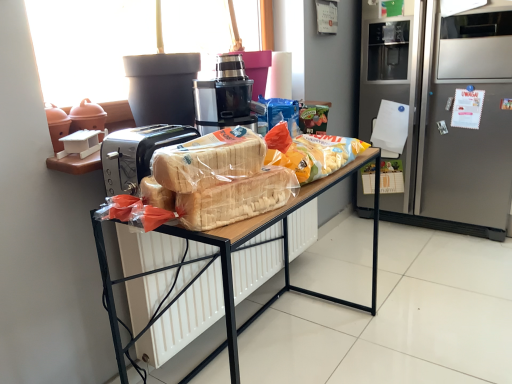
Describe the element at coordinates (222, 178) in the screenshot. Image resolution: width=512 pixels, height=384 pixels. I see `translucent plastic bread at center, positioned as the third snack in back-to-front order` at that location.

Image resolution: width=512 pixels, height=384 pixels. Describe the element at coordinates (224, 97) in the screenshot. I see `black plastic juicer at center` at that location.

Describe the element at coordinates (310, 152) in the screenshot. This screenshot has width=512, height=384. I see `translucent plastic bag of chips at center, which is counted as the 1th snack, starting from the back` at that location.

What do you see at coordinates (209, 160) in the screenshot? This screenshot has height=384, width=512. I see `translucent plastic bread at center, arranged as the second snack when viewed from the back` at bounding box center [209, 160].

Identify the location of wooden desk at center. The height and width of the screenshot is (384, 512). (283, 255).

Image resolution: width=512 pixels, height=384 pixels. Find the location of `desk in front of the satin silver refrigerator at right`. desk in front of the satin silver refrigerator at right is located at coordinates (283, 255).

Is point (106, 274) in front of point (486, 212)?

Yes, point (106, 274) is in front of point (486, 212).

How different are the orientations of wooden desk at center and satin silver refrigerator at right in degrees?

91.6 degrees.

Does wooden desk at center have a greater height compared to satin silver refrigerator at right?

No.

Consider the image. Considering the sizes of objects satin silver refrigerator at right and translucent plastic bread at center, which is the second snack from front to back, in the image provided, who is smaller, satin silver refrigerator at right or translucent plastic bread at center, which is the second snack from front to back,?

Smaller between the two is translucent plastic bread at center, which is the second snack from front to back.

From a real-world perspective, is satin silver refrigerator at right on top of translucent plastic bread at center, arranged as the second snack when viewed from the back?

No, from a real-world perspective, satin silver refrigerator at right is not over translucent plastic bread at center, arranged as the second snack when viewed from the back

Considering the sizes of satin silver refrigerator at right and translucent plastic bread at center, arranged as the second snack when viewed from the back, in the image, is satin silver refrigerator at right taller or shorter than translucent plastic bread at center, arranged as the second snack when viewed from the back,?

satin silver refrigerator at right is taller than translucent plastic bread at center, arranged as the second snack when viewed from the back.

From the image's perspective, is satin silver refrigerator at right on top of translucent plastic bread at center, arranged as the second snack when viewed from the back?

Correct, satin silver refrigerator at right appears higher than translucent plastic bread at center, arranged as the second snack when viewed from the back, in the image.

Are translucent plastic bread at center, which is the second snack from front to back, and translucent plastic bag of chips at center, which is counted as the 1th snack, starting from the back, located far from each other?

That's not correct — translucent plastic bread at center, which is the second snack from front to back, is a little close to translucent plastic bag of chips at center, which is counted as the 1th snack, starting from the back.

Does point (168, 168) come farther from viewer compared to point (332, 138)?

That is False.

From a real-world perspective, does translucent plastic bread at center, which is the second snack from front to back, stand above translucent plastic bag of chips at center, which is counted as the 1th snack, starting from the back?

Yes, from a real-world perspective, translucent plastic bread at center, which is the second snack from front to back, is above translucent plastic bag of chips at center, which is counted as the 1th snack, starting from the back.

Considering the relative sizes of translucent plastic bread at center, which is the second snack from front to back, and translucent plastic bag of chips at center, which is counted as the 1th snack, starting from the back, in the image provided, is translucent plastic bread at center, which is the second snack from front to back, smaller than translucent plastic bag of chips at center, which is counted as the 1th snack, starting from the back,?

Indeed, translucent plastic bread at center, which is the second snack from front to back, has a smaller size compared to translucent plastic bag of chips at center, which is counted as the 1th snack, starting from the back.

Is translucent plastic bread at center, the 1th snack viewed from the front, bigger than translucent plastic bag of chips at center, which is counted as the 1th snack, starting from the back?

No.

In the scene shown: Considering the relative sizes of translucent plastic bread at center, the 1th snack viewed from the front, and translucent plastic bag of chips at center, which is counted as the 1th snack, starting from the back, in the image provided, is translucent plastic bread at center, the 1th snack viewed from the front, shorter than translucent plastic bag of chips at center, which is counted as the 1th snack, starting from the back,?

Yes, translucent plastic bread at center, the 1th snack viewed from the front, is shorter than translucent plastic bag of chips at center, which is counted as the 1th snack, starting from the back.

Looking at their sizes, would you say translucent plastic bread at center, positioned as the third snack in back-to-front order, is wider or thinner than translucent plastic bag of chips at center, which appears as the 3th snack when viewed from the front?

translucent plastic bread at center, positioned as the third snack in back-to-front order, is thinner than translucent plastic bag of chips at center, which appears as the 3th snack when viewed from the front.

Is translucent plastic bread at center, positioned as the third snack in back-to-front order, to the left or to the right of translucent plastic bag of chips at center, which is counted as the 1th snack, starting from the back, in the image?

translucent plastic bread at center, positioned as the third snack in back-to-front order, is to the left of translucent plastic bag of chips at center, which is counted as the 1th snack, starting from the back.

From a real-world perspective, is satin silver refrigerator at right over translucent plastic bag of chips at center, which appears as the 3th snack when viewed from the front?

No, from a real-world perspective, satin silver refrigerator at right is not on top of translucent plastic bag of chips at center, which appears as the 3th snack when viewed from the front.

Which object is further away from the camera taking this photo, satin silver refrigerator at right or translucent plastic bag of chips at center, which is counted as the 1th snack, starting from the back?

satin silver refrigerator at right is more distant.

Between satin silver refrigerator at right and translucent plastic bag of chips at center, which is counted as the 1th snack, starting from the back, which one has less height?

translucent plastic bag of chips at center, which is counted as the 1th snack, starting from the back, is shorter.

What's the angular difference between satin silver refrigerator at right and translucent plastic bag of chips at center, which is counted as the 1th snack, starting from the back,'s facing directions?

satin silver refrigerator at right and translucent plastic bag of chips at center, which is counted as the 1th snack, starting from the back, are facing 90.4 degrees away from each other.

Would you say satin silver refrigerator at right contains wooden desk at center?

Actually, wooden desk at center is outside satin silver refrigerator at right.

Could you tell me if satin silver refrigerator at right is turned towards wooden desk at center?

Yes.

Between satin silver refrigerator at right and wooden desk at center, which one appears on the left side from the viewer's perspective?

Positioned to the left is wooden desk at center.

Considering the sizes of objects translucent plastic bread at center, positioned as the third snack in back-to-front order, and black plastic juicer at center in the image provided, who is smaller, translucent plastic bread at center, positioned as the third snack in back-to-front order, or black plastic juicer at center?

With smaller size is translucent plastic bread at center, positioned as the third snack in back-to-front order.

Is point (186, 205) closer or farther from the camera than point (194, 84)?

Clearly, point (186, 205) is closer to the camera than point (194, 84).

At what (x,y) coordinates should I click in order to perform the action: click on refrigerator located above the wooden desk at center (from a real-world perspective). Please return your answer as a coordinate pair (x, y). This screenshot has width=512, height=384. Looking at the image, I should click on (446, 112).

I want to click on refrigerator behind the translucent plastic bread at center, which is the second snack from front to back, so click(x=446, y=112).

Looking at the image, which one is located further to translucent plastic bread at center, the 1th snack viewed from the front, translucent plastic bread at center, which is the second snack from front to back, or satin silver refrigerator at right?

The object further to translucent plastic bread at center, the 1th snack viewed from the front, is satin silver refrigerator at right.

Looking at the image, which one is located further to translucent plastic bread at center, positioned as the third snack in back-to-front order, translucent plastic bag of chips at center, which is counted as the 1th snack, starting from the back, or black plastic juicer at center?

Among the two, translucent plastic bag of chips at center, which is counted as the 1th snack, starting from the back, is located further to translucent plastic bread at center, positioned as the third snack in back-to-front order.

Which object lies nearer to the anchor point wooden desk at center, translucent plastic bread at center, the 1th snack viewed from the front, or satin silver refrigerator at right?

Result: translucent plastic bread at center, the 1th snack viewed from the front, lies closer to wooden desk at center than the other object.

Based on their spatial positions, is wooden desk at center or translucent plastic bag of chips at center, which is counted as the 1th snack, starting from the back, closer to black plastic juicer at center?

translucent plastic bag of chips at center, which is counted as the 1th snack, starting from the back, is closer to black plastic juicer at center.

Which object lies nearer to the anchor point translucent plastic bag of chips at center, which appears as the 3th snack when viewed from the front, translucent plastic bread at center, the 1th snack viewed from the front, or translucent plastic bread at center, arranged as the second snack when viewed from the back?

Among the two, translucent plastic bread at center, the 1th snack viewed from the front, is located nearer to translucent plastic bag of chips at center, which appears as the 3th snack when viewed from the front.

Looking at the image, which one is located closer to translucent plastic bread at center, the 1th snack viewed from the front, wooden desk at center or translucent plastic bag of chips at center, which appears as the 3th snack when viewed from the front?

Among the two, translucent plastic bag of chips at center, which appears as the 3th snack when viewed from the front, is located nearer to translucent plastic bread at center, the 1th snack viewed from the front.

Considering their positions, is translucent plastic bag of chips at center, which appears as the 3th snack when viewed from the front, positioned closer to translucent plastic bread at center, which is the second snack from front to back, than wooden desk at center?

Among the two, translucent plastic bag of chips at center, which appears as the 3th snack when viewed from the front, is located nearer to translucent plastic bread at center, which is the second snack from front to back.

Based on the photo, considering their positions, is translucent plastic bread at center, positioned as the third snack in back-to-front order, positioned further to wooden desk at center than translucent plastic bread at center, arranged as the second snack when viewed from the back?

translucent plastic bread at center, arranged as the second snack when viewed from the back, lies further to wooden desk at center than the other object.

Find the location of a particular element. This screenshot has width=512, height=384. snack between translucent plastic bread at center, arranged as the second snack when viewed from the back, and wooden desk at center, in the vertical direction is located at coordinates (222, 178).

Where is `snack located between translucent plastic bread at center, the 1th snack viewed from the front, and translucent plastic bag of chips at center, which is counted as the 1th snack, starting from the back, in the left-right direction`? The width and height of the screenshot is (512, 384). snack located between translucent plastic bread at center, the 1th snack viewed from the front, and translucent plastic bag of chips at center, which is counted as the 1th snack, starting from the back, in the left-right direction is located at coordinates (209, 160).

The image size is (512, 384). Identify the location of desk located between translucent plastic bread at center, which is the second snack from front to back, and satin silver refrigerator at right in the left-right direction. (283, 255).

The height and width of the screenshot is (384, 512). In order to click on snack between translucent plastic bread at center, arranged as the second snack when viewed from the back, and black plastic juicer at center in the front-back direction in this screenshot , I will do `click(310, 152)`.